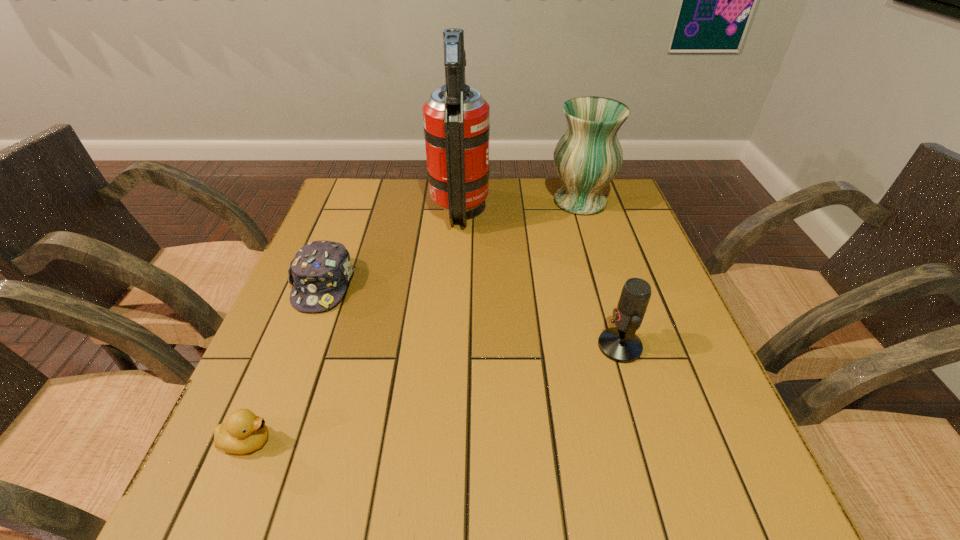
Find the location of a particular element. The height and width of the screenshot is (540, 960). blank space located 0.240m on the side of the third tallest object with the red ring is located at coordinates (483, 346).

This screenshot has width=960, height=540. In order to click on vacant region located on the side of the third tallest object with the red ring in this screenshot , I will do `click(468, 346)`.

Locate an element on the screen. This screenshot has width=960, height=540. free spot located 0.310m on the front-facing side of the headwear is located at coordinates (261, 448).

Where is `free space located on the face of the duckling`? Image resolution: width=960 pixels, height=540 pixels. free space located on the face of the duckling is located at coordinates (501, 441).

Where is `fire extinguisher located in the far edge section of the desktop`? fire extinguisher located in the far edge section of the desktop is located at coordinates (456, 118).

I want to click on vase that is at the far edge, so click(588, 156).

Where is `headwear that is at the left edge`? headwear that is at the left edge is located at coordinates (319, 273).

Locate an element on the screen. This screenshot has width=960, height=540. duckling present at the left edge is located at coordinates (244, 432).

What are the coordinates of `vase present at the right edge` in the screenshot? It's located at (588, 156).

Find the location of a particular element. This screenshot has height=540, width=960. microphone situated at the right edge is located at coordinates (620, 344).